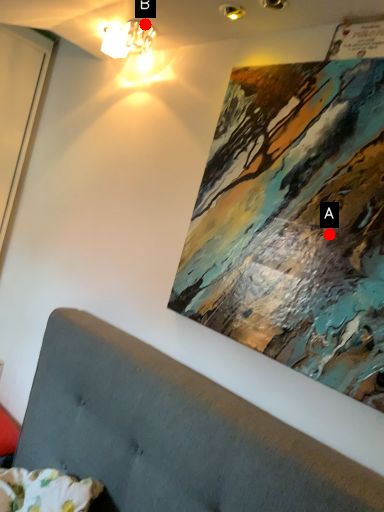
Question: Two points are circled on the image, labeled by A and B beside each circle. Which point is closer to the camera taking this photo?

Choices:
 (A) A is closer
 (B) B is closer

Answer: (A)